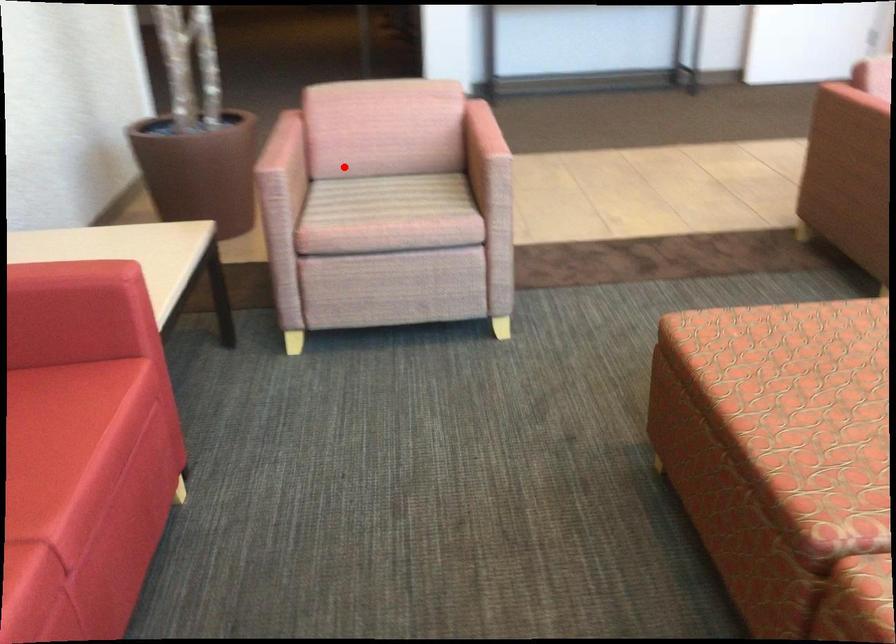
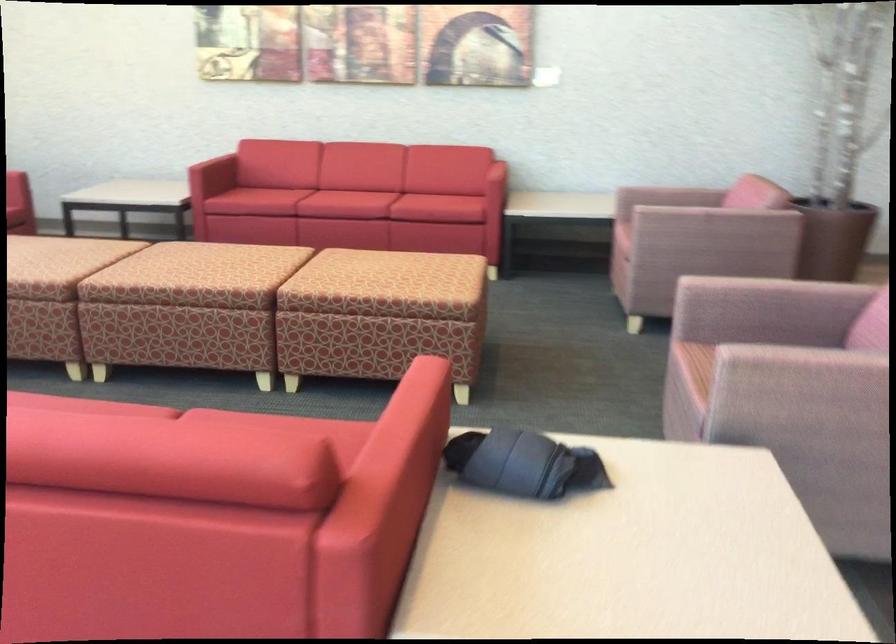
The point at the highlighted location is marked in the first image. Where is the corresponding point in the second image?

(669, 196)